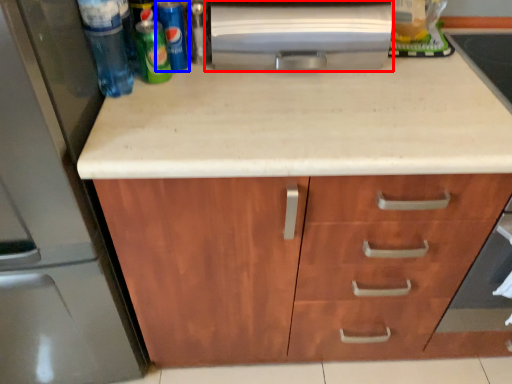
Question: Which object is further to the camera taking this photo, appliance (highlighted by a red box) or beer (highlighted by a blue box)?

Choices:
 (A) appliance
 (B) beer

Answer: (B)